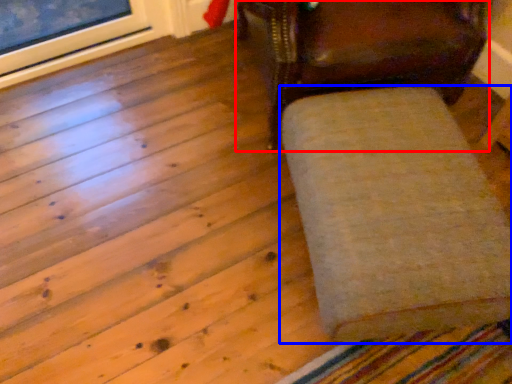
Question: Which of the following is the closest to the observer, chair (highlighted by a red box) or furniture (highlighted by a blue box)?

Choices:
 (A) chair
 (B) furniture

Answer: (B)